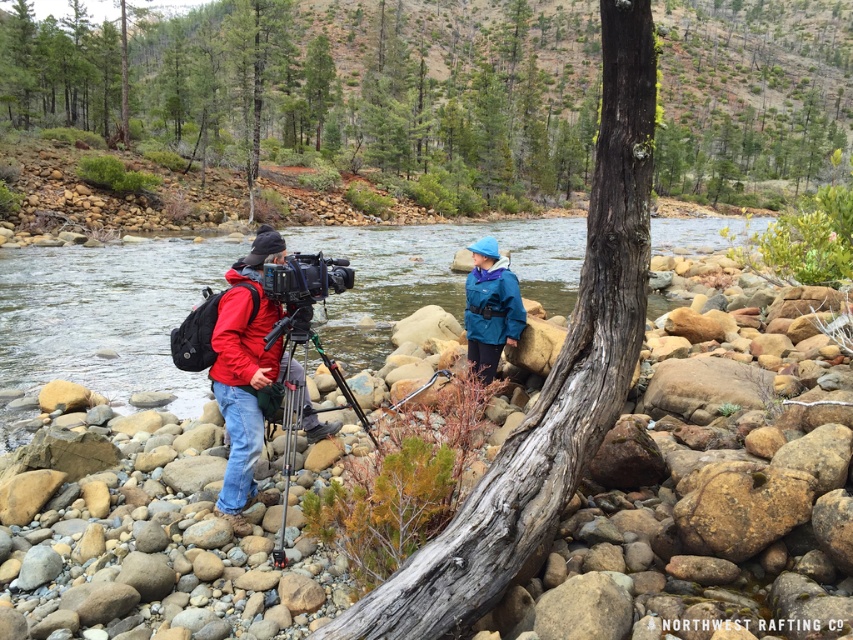
You are planning to cross the river using the silver metallic tripod at center as a bridge. Given that the clear water at stream left is wider than the tripod, will the tripod reach across the water?

The clear water at stream left is wider than the silver metallic tripod at center, so the tripod will not span the entire width of the water and thus cannot be used as a bridge.

You are a photographer trying to capture a clear shot of the matte black video camera at center and the silver metallic tripod at center. Which object should you focus on first to ensure it appears sharp in your photo?

You should focus on the matte black video camera at center first because it is closer to you than the silver metallic tripod at center, so it requires proper focus adjustment before the background object.